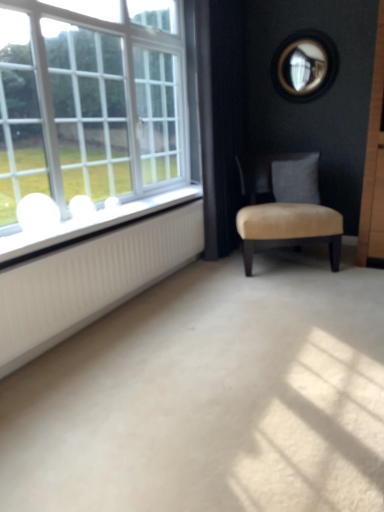
Question: Considering the positions of point (14, 303) and point (51, 240), is point (14, 303) closer or farther from the camera than point (51, 240)?

Choices:
 (A) closer
 (B) farther

Answer: (A)

Question: From a real-world perspective, is white ribbed radiator at left above or below white glossy window sill at left?

Choices:
 (A) below
 (B) above

Answer: (A)

Question: Based on their relative distances, which object is nearer to the white ribbed radiator at left?

Choices:
 (A) white glossy window sill at left
 (B) beige velvet chair at center
 (C) white glass window at left
 (D) suede gray pillow at center

Answer: (A)

Question: Considering the real-world distances, which object is farthest from the white glass window at left?

Choices:
 (A) white ribbed radiator at left
 (B) beige velvet chair at center
 (C) suede gray pillow at center
 (D) white glossy window sill at left

Answer: (C)